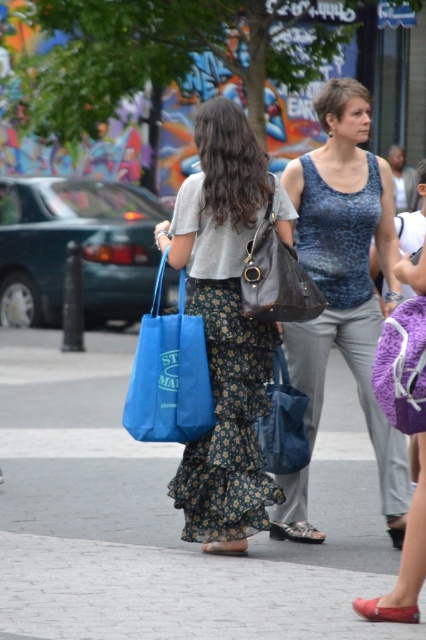
You are standing on the cobblestone pavement at center and want to walk towards the two women in the scene. Which direction should you move to reach them?

The cobblestone pavement at center is located at point (164,516), so you should move forward towards the direction where the women are walking on the sidewalk.

You are a photographer trying to capture a closeup of the cobblestone pavement at center and the matte red sandal at lower center. Since you want both objects to appear equally large in the photo, which object should you move closer to?

You should move closer to the cobblestone pavement at center because it is larger than the matte red sandal at lower center. To make both appear the same size in the photo, the larger object needs to be positioned closer to the camera.